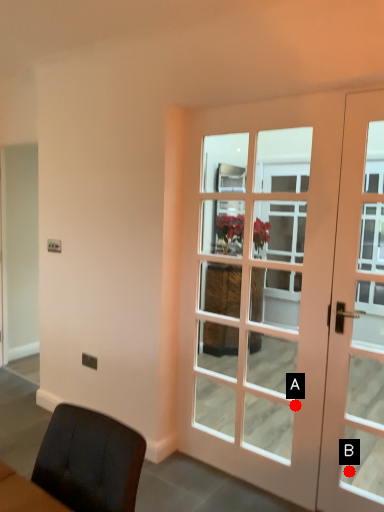
Question: Two points are circled on the image, labeled by A and B beside each circle. Which point is closer to the camera?

Choices:
 (A) A is closer
 (B) B is closer

Answer: (A)